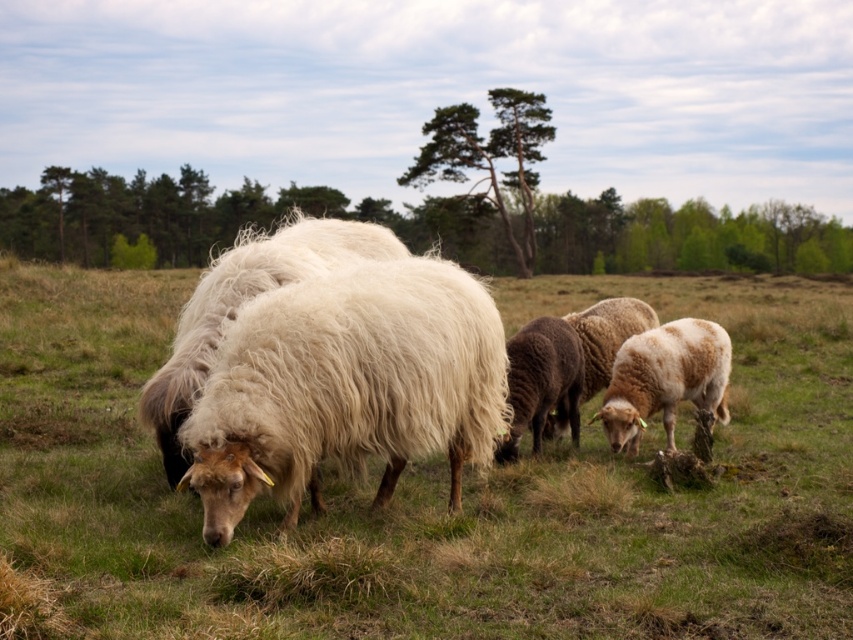
Is dark brown woolly sheep at center positioned in front of white woolen sheep at center?

Yes, dark brown woolly sheep at center is in front of white woolen sheep at center.

Is dark brown woolly sheep at center further to the viewer compared to white woolen sheep at center?

No, it is in front of white woolen sheep at center.

Where is `dark brown woolly sheep at center`? dark brown woolly sheep at center is located at coordinates (541, 380).

Is point (67, 344) positioned behind point (186, 435)?

Yes.

This screenshot has height=640, width=853. Describe the element at coordinates (436, 490) in the screenshot. I see `fuzzy white sheep at center` at that location.

Which is in front, point (444, 602) or point (259, 465)?

Point (444, 602) is more forward.

I want to click on fuzzy white sheep at center, so click(x=436, y=490).

Between white woolly sheep at center and light brown woolly sheep at center, which one has less height?

With less height is light brown woolly sheep at center.

Does white woolly sheep at center appear on the right side of light brown woolly sheep at center?

In fact, white woolly sheep at center is to the left of light brown woolly sheep at center.

Who is more distant from viewer, [234,273] or [685,323]?

The point [685,323] is more distant.

Locate an element on the screen. This screenshot has height=640, width=853. white woolly sheep at center is located at coordinates (241, 301).